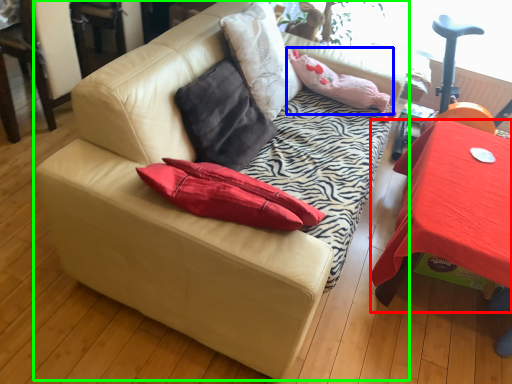
Question: Which object is positioned closest to table (highlighted by a red box)? Select from pillow (highlighted by a blue box) and studio couch (highlighted by a green box).

Choices:
 (A) pillow
 (B) studio couch

Answer: (A)